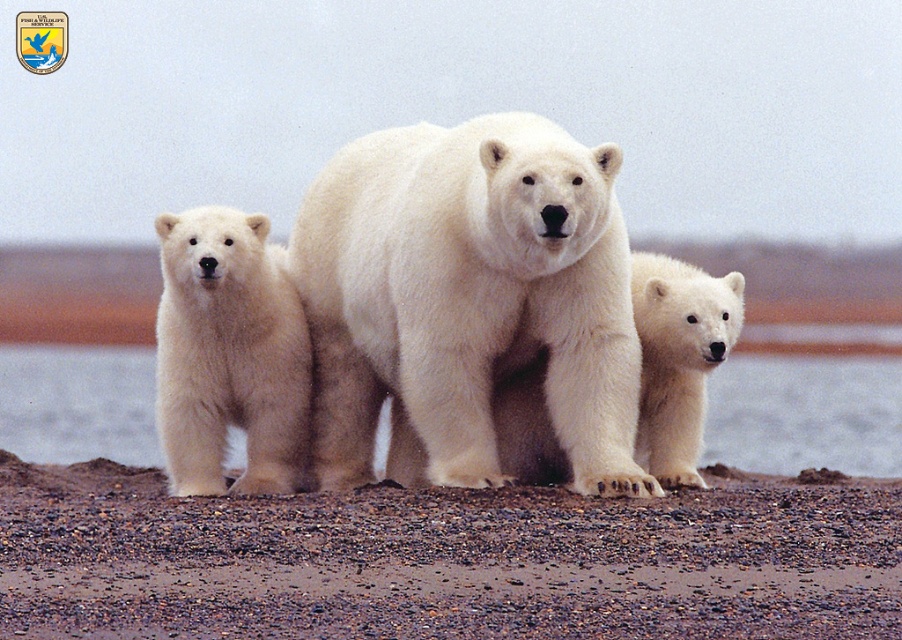
From the picture: Is the position of white fur water at center more distant than that of white fluffy bear cub at center?

Yes, white fur water at center is behind white fluffy bear cub at center.

Who is more distant from viewer, (93, 380) or (658, 300)?

The point (93, 380) is more distant.

This screenshot has width=902, height=640. Describe the element at coordinates (805, 413) in the screenshot. I see `white fur water at center` at that location.

I want to click on white fur water at center, so (x=805, y=413).

Does brown gravel at center have a greater width compared to white fur water at center?

No, brown gravel at center is not wider than white fur water at center.

Is brown gravel at center positioned before white fur water at center?

Yes, brown gravel at center is in front of white fur water at center.

Who is more forward, (378, 493) or (737, 396)?

Point (378, 493) is in front.

What are the coordinates of `brown gravel at center` in the screenshot? It's located at (443, 561).

Between brown gravel at center and white fluffy bear cub at center, which one appears on the right side from the viewer's perspective?

From the viewer's perspective, white fluffy bear cub at center appears more on the right side.

Is brown gravel at center taller than white fluffy bear cub at center?

In fact, brown gravel at center may be shorter than white fluffy bear cub at center.

Find the location of a particular element. brown gravel at center is located at coordinates (443, 561).

Where is `brown gravel at center`? Image resolution: width=902 pixels, height=640 pixels. brown gravel at center is located at coordinates (443, 561).